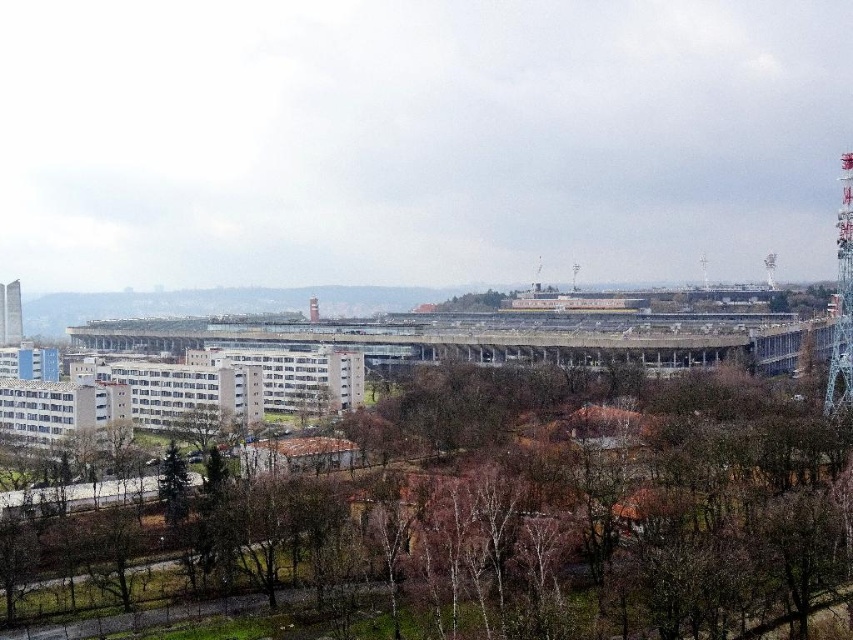
Find the location of `brown leafless tree at center`. brown leafless tree at center is located at coordinates (525, 516).

In the scene shown: Measure the distance between point (695, 556) and camera.

Point (695, 556) and camera are 108.67 meters apart from each other.

Find the location of a particular element. This screenshot has width=853, height=640. brown leafless tree at center is located at coordinates (525, 516).

Who is positioned more to the right, smooth concrete tower at left or smooth red tower at center?

Positioned to the right is smooth red tower at center.

Which is behind, point (4, 336) or point (318, 321)?

The point (4, 336) is more distant.

At what (x,y) coordinates should I click in order to perform the action: click on smooth concrete tower at left. Please return your answer as a coordinate pair (x, y). This screenshot has width=853, height=640. Looking at the image, I should click on (10, 314).

Is the position of metallic lattice tower at right more distant than that of smooth concrete tower at left?

No.

Is metallic lattice tower at right below smooth concrete tower at left?

No, metallic lattice tower at right is not below smooth concrete tower at left.

Is point (844, 192) farther from camera compared to point (9, 337)?

No, it is not.

At what (x,y) coordinates should I click in order to perform the action: click on metallic lattice tower at right. Please return your answer as a coordinate pair (x, y). The image size is (853, 640). Looking at the image, I should click on (842, 301).